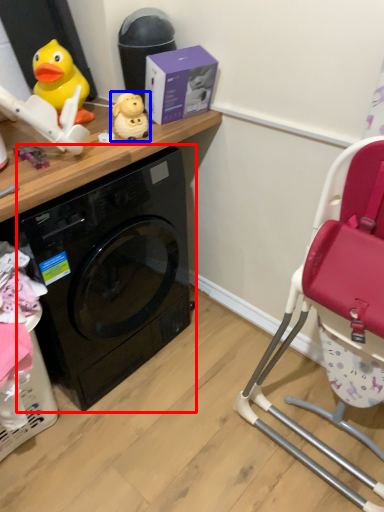
Question: Which object is closer to the camera taking this photo, washing machine (highlighted by a red box) or toy (highlighted by a blue box)?

Choices:
 (A) washing machine
 (B) toy

Answer: (A)